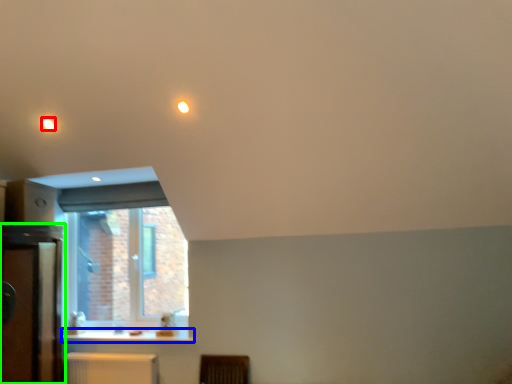
Question: Which is farther away from lighting (highlighted by a red box)? counter top (highlighted by a blue box) or dresser (highlighted by a green box)?

Choices:
 (A) counter top
 (B) dresser

Answer: (A)